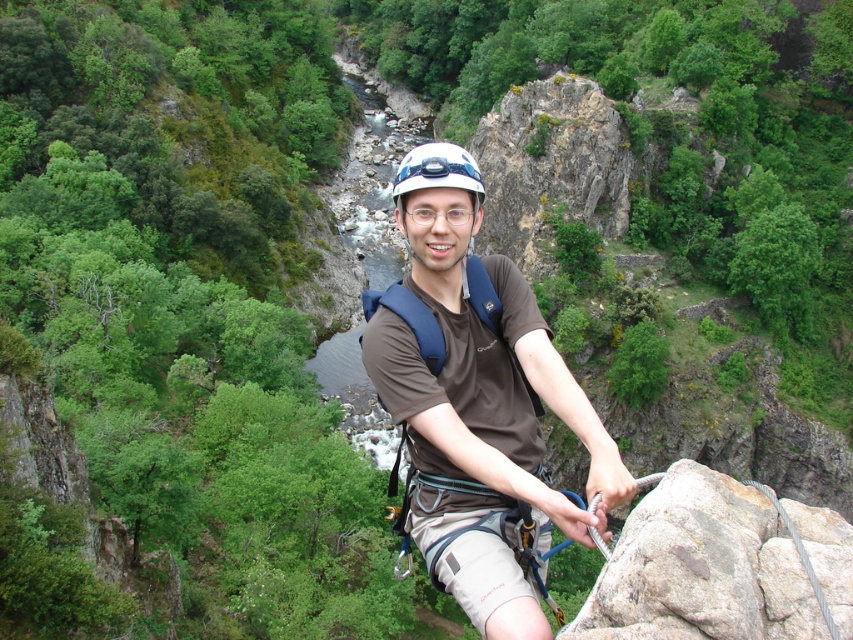
Between brown fabric shirt at center and white matte helmet at center, which one has more height?

With more height is white matte helmet at center.

Does brown fabric shirt at center appear under white matte helmet at center?

Correct, brown fabric shirt at center is located below white matte helmet at center.

At what (x,y) coordinates should I click in order to perform the action: click on brown fabric shirt at center. Please return your answer as a coordinate pair (x, y). This screenshot has height=640, width=853. Looking at the image, I should click on point(477,403).